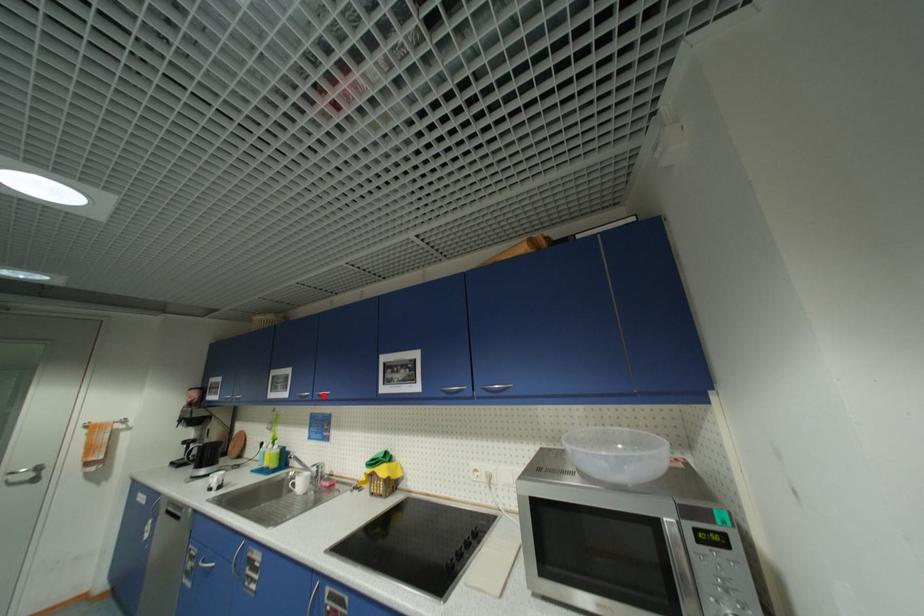
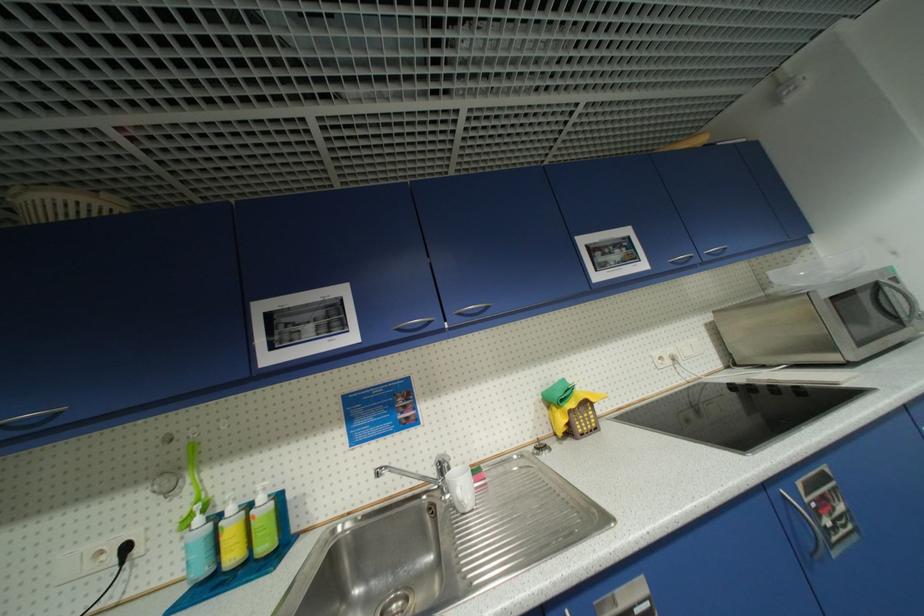
Where in the second image is the point corresponding to the highlighted location from the first image?

(466, 315)